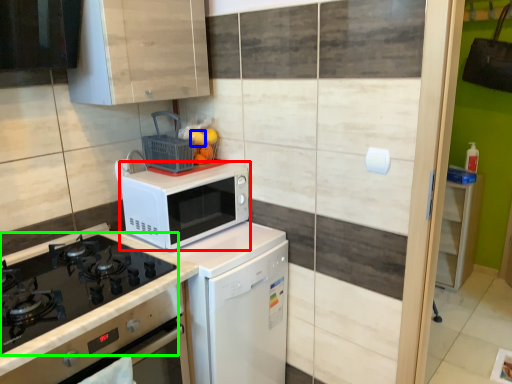
Question: Which is farther away from microwave oven (highlighted by a red box)? orange (highlighted by a blue box) or gas stove (highlighted by a green box)?

Choices:
 (A) orange
 (B) gas stove

Answer: (A)